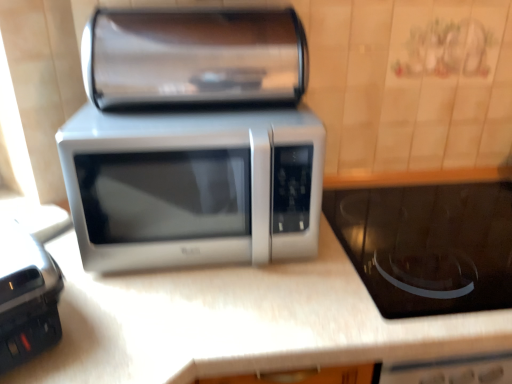
The image size is (512, 384). I want to click on free location above satin silver microwave at center (from a real-world perspective), so click(204, 115).